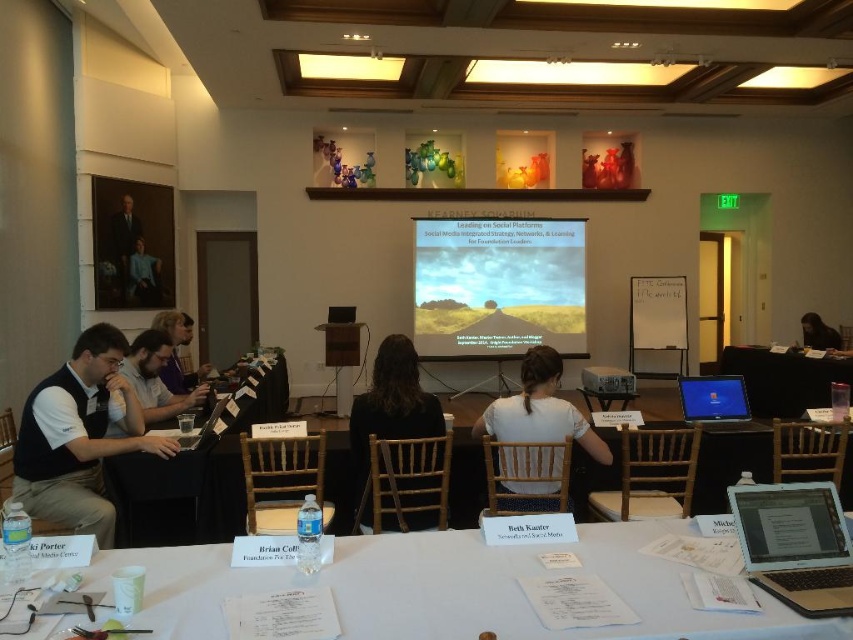
Question: Does black fabric jacket at center appear under formal black suit at upper left?

Choices:
 (A) yes
 (B) no

Answer: (A)

Question: Among these objects, which one is farthest from the camera?

Choices:
 (A) white matte vest at left
 (B) silver metallic laptop at lower right
 (C) matte black shirt at upper left

Answer: (C)

Question: Among these objects, which one is farthest from the camera?

Choices:
 (A) matte black shirt at upper left
 (B) formal black suit at upper left
 (C) white plastic projector at center

Answer: (A)

Question: Does matte projector screen at center have a lesser width compared to black fabric chair at upper right?

Choices:
 (A) yes
 (B) no

Answer: (B)

Question: Is white matte vest at left wider than black fabric jacket at center?

Choices:
 (A) yes
 (B) no

Answer: (A)

Question: Which is nearer to the black fabric chair at upper right?

Choices:
 (A) white paper at center
 (B) blue glossy monitor at center right
 (C) matte projector screen at center
 (D) white cotton shirt at center

Answer: (C)